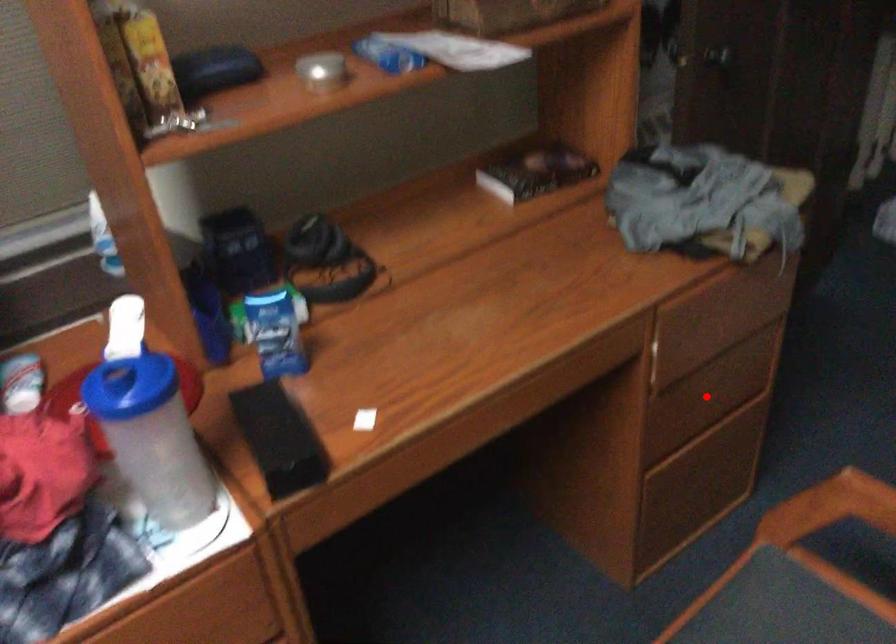
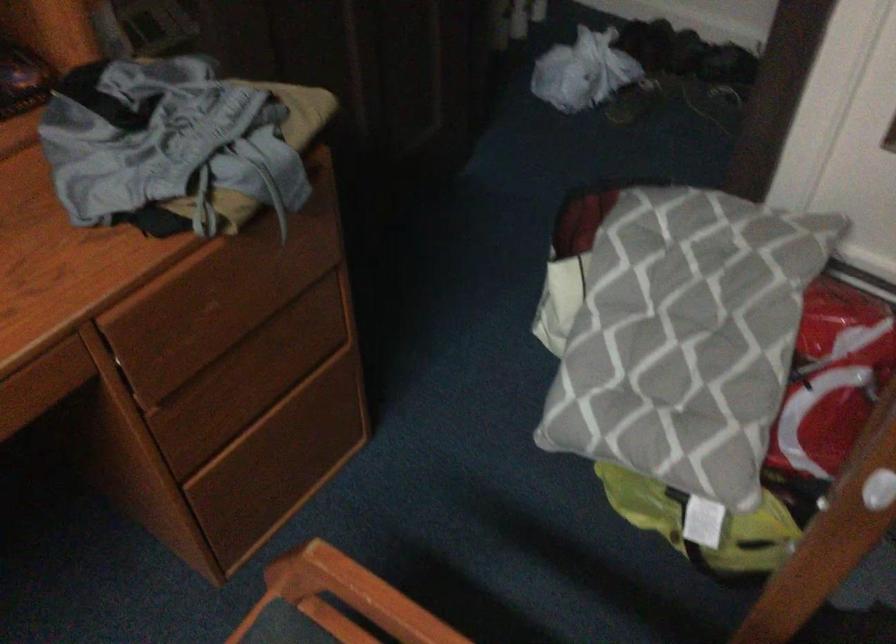
In the second image, find the point that corresponds to the highlighted location in the first image.

(254, 377)